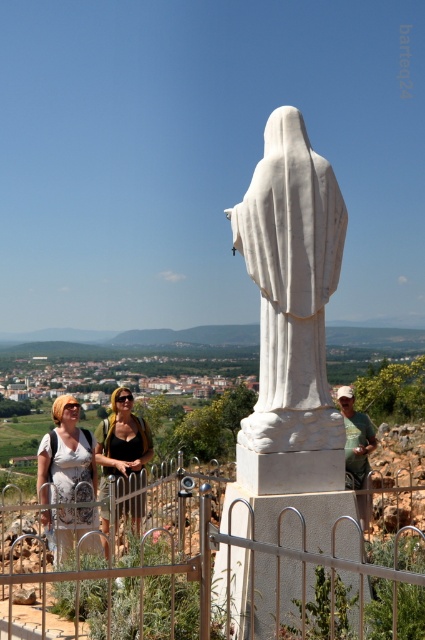
Does matte white blouse at center have a lesser width compared to white stone statue at center?

In fact, matte white blouse at center might be wider than white stone statue at center.

Measure the distance from matte white blouse at center to white stone statue at center.

A distance of 4.48 meters exists between matte white blouse at center and white stone statue at center.

You are a GUI agent. You are given a task and a screenshot of the screen. Output one action in this format:
    pyautogui.click(x=<x>, y=<y>)
    Task: Click on the matte white blouse at center
    
    Given the screenshot: What is the action you would take?
    67,456

Between matte white blouse at center and black fabric dress at lower center, which one is positioned lower?

matte white blouse at center is below.

Consider the image. Measure the distance between matte white blouse at center and black fabric dress at lower center.

matte white blouse at center and black fabric dress at lower center are 5.35 feet apart.

At what (x,y) coordinates should I click in order to perform the action: click on matte white blouse at center. Please return your answer as a coordinate pair (x, y). This screenshot has width=425, height=640. Looking at the image, I should click on (67, 456).

You are a GUI agent. You are given a task and a screenshot of the screen. Output one action in this format:
    pyautogui.click(x=<x>, y=<y>)
    Task: Click on the matte white blouse at center
    This screenshot has width=425, height=640.
    Given the screenshot: What is the action you would take?
    pyautogui.click(x=67, y=456)

Between gold metallic fence at lower center and matte white blouse at center, which one has more height?

With more height is gold metallic fence at lower center.

Does gold metallic fence at lower center appear under matte white blouse at center?

Yes.

Does point (129, 516) lie behind point (59, 520)?

Yes, point (129, 516) is behind point (59, 520).

Image resolution: width=425 pixels, height=640 pixels. Identify the location of gold metallic fence at lower center. (215, 560).